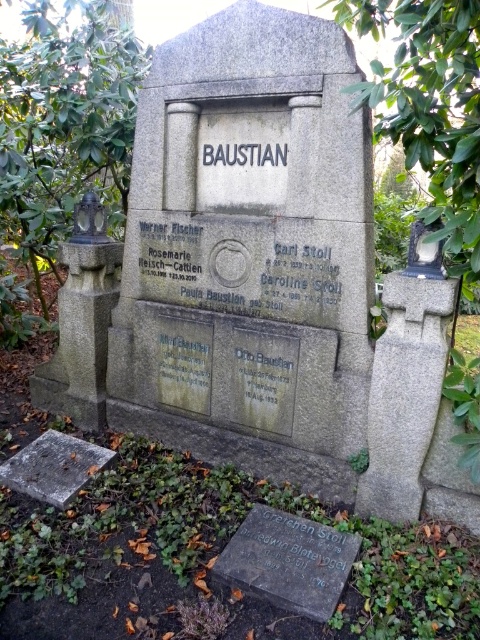
Question: Is green leafy tree at center in front of green leafy tree at upper center?

Choices:
 (A) no
 (B) yes

Answer: (A)

Question: Is green leafy tree at center to the right of green leafy tree at upper center from the viewer's perspective?

Choices:
 (A) no
 (B) yes

Answer: (A)

Question: Which point is closer to the camera?

Choices:
 (A) (16, 330)
 (B) (414, 61)

Answer: (B)

Question: Which point is closer to the camera?

Choices:
 (A) (132, 67)
 (B) (428, 13)

Answer: (B)

Question: Observing the image, what is the correct spatial positioning of green leafy tree at center in reference to green leafy tree at upper center?

Choices:
 (A) left
 (B) right

Answer: (A)